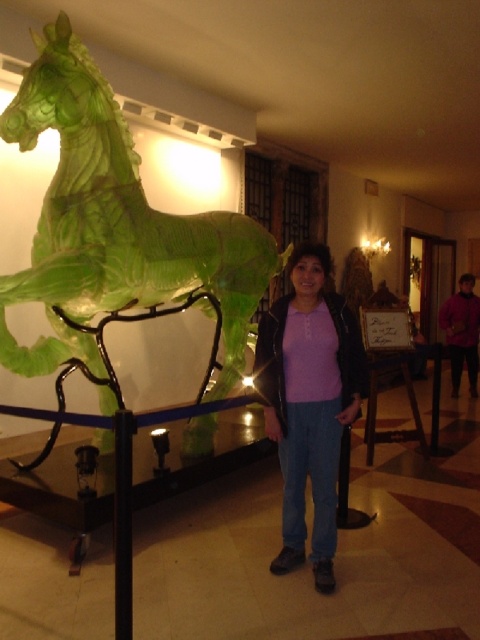
Which is more to the right, green glass horse at left or purple sweater at center?

purple sweater at center is more to the right.

Can you confirm if green glass horse at left is positioned above purple sweater at center?

Correct, green glass horse at left is located above purple sweater at center.

Between point (23, 96) and point (476, 323), which one is positioned in front?

Point (23, 96) is in front.

The height and width of the screenshot is (640, 480). What are the coordinates of `green glass horse at left` in the screenshot? It's located at (115, 224).

Does green glass horse at left appear over matte purple sweater at center?

Yes, green glass horse at left is above matte purple sweater at center.

Which is above, green glass horse at left or matte purple sweater at center?

Positioned higher is green glass horse at left.

This screenshot has width=480, height=640. What do you see at coordinates (115, 224) in the screenshot? I see `green glass horse at left` at bounding box center [115, 224].

At what (x,y) coordinates should I click in order to perform the action: click on green glass horse at left. Please return your answer as a coordinate pair (x, y). The width and height of the screenshot is (480, 640). Looking at the image, I should click on [115, 224].

Can you confirm if matte purple sweater at center is thinner than purple sweater at center?

Correct, matte purple sweater at center's width is less than purple sweater at center's.

Is point (334, 305) farther from camera compared to point (472, 365)?

No, (334, 305) is in front of (472, 365).

Where is `matte purple sweater at center`? matte purple sweater at center is located at coordinates (309, 403).